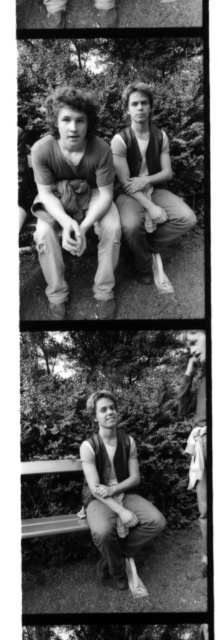
You are a photographer analyzing the composition of this black and white photo. You notice a point at coordinates (74, 198). What object is located at this point?

The point at coordinates (74, 198) has matte brown hair at center.

You are an assistant organizing a photo archive. You need to describe the spatial relationship between the matte black tank top at center and the matte brown vest at right in the top frame of the contact sheet. Which is positioned lower?

The matte black tank top at center is located below the matte brown vest at right, so the matte black tank top at center is positioned lower.

You are looking at the top frame of the contact sheet and notice two points marked in the image. Which point is closer to you, point (153, 129) or point (194, 358)?

Point (153, 129) is closer to you because it is further to the viewer than point (194, 358).